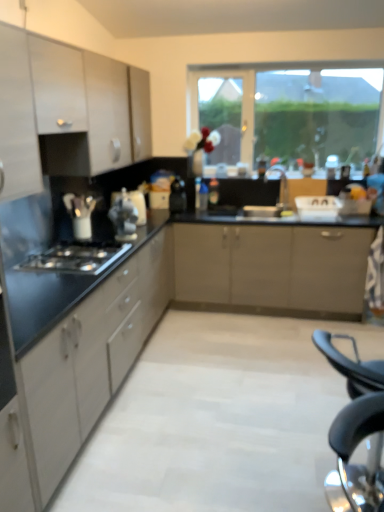
Question: Which direction should I rotate to look at white glossy kettle at center, placed as the second appliance when sorted from right to left?

Choices:
 (A) right
 (B) left

Answer: (B)

Question: From the image's perspective, is transparent glass window at upper center on top of matte white cabinet at left, marked as the second cabinetry in a bottom-to-top arrangement?

Choices:
 (A) no
 (B) yes

Answer: (B)

Question: From the image's perspective, is transparent glass window at upper center beneath matte white cabinet at left, which ranks as the 2th cabinetry in top-to-bottom order?

Choices:
 (A) yes
 (B) no

Answer: (B)

Question: Can you confirm if transparent glass window at upper center is bigger than matte white cabinet at left, marked as the second cabinetry in a bottom-to-top arrangement?

Choices:
 (A) yes
 (B) no

Answer: (B)

Question: Is transparent glass window at upper center positioned beyond the bounds of matte white cabinet at left, which ranks as the 2th cabinetry in top-to-bottom order?

Choices:
 (A) yes
 (B) no

Answer: (A)

Question: Is the position of transparent glass window at upper center less distant than that of matte white cabinet at left, marked as the second cabinetry in a bottom-to-top arrangement?

Choices:
 (A) no
 (B) yes

Answer: (A)

Question: Can you confirm if transparent glass window at upper center is taller than matte white cabinet at left, which ranks as the 2th cabinetry in top-to-bottom order?

Choices:
 (A) yes
 (B) no

Answer: (A)

Question: Does white glossy kettle at left, which appears as the second appliance when viewed from the front, have a greater height compared to black plastic folding chair at lower right?

Choices:
 (A) yes
 (B) no

Answer: (B)

Question: Can you confirm if white glossy kettle at left, which appears as the fourth appliance when viewed from the right, is shorter than black plastic folding chair at lower right?

Choices:
 (A) yes
 (B) no

Answer: (A)

Question: Is white glossy kettle at left, which appears as the second appliance when viewed from the front, wider than black plastic folding chair at lower right?

Choices:
 (A) no
 (B) yes

Answer: (A)

Question: Is white glossy kettle at left, arranged as the 1th appliance when viewed from the left, far away from black plastic folding chair at lower right?

Choices:
 (A) yes
 (B) no

Answer: (A)

Question: Is the position of white glossy kettle at left, which appears as the third appliance when viewed from the back, less distant than that of black plastic folding chair at lower right?

Choices:
 (A) no
 (B) yes

Answer: (A)

Question: Is white glossy kettle at left, which appears as the third appliance when viewed from the back, bigger than black plastic folding chair at lower right?

Choices:
 (A) yes
 (B) no

Answer: (B)

Question: From the image's perspective, is white glossy kettle at center, acting as the 3th appliance starting from the front, over matte black countertop at left, arranged as the third cabinetry when viewed from the top?

Choices:
 (A) yes
 (B) no

Answer: (A)